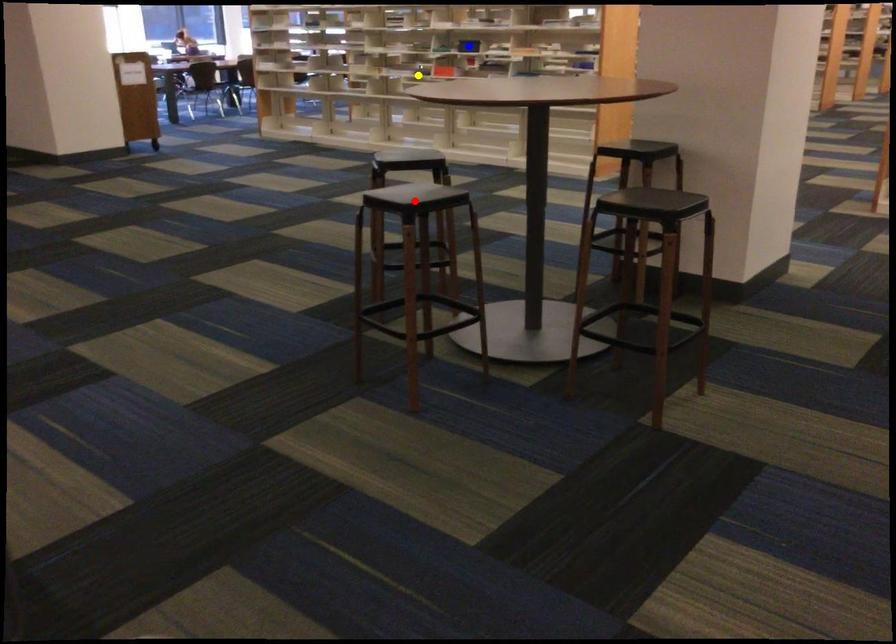
Order these from nearest to farthest:
A) red point
B) blue point
C) yellow point

red point
blue point
yellow point